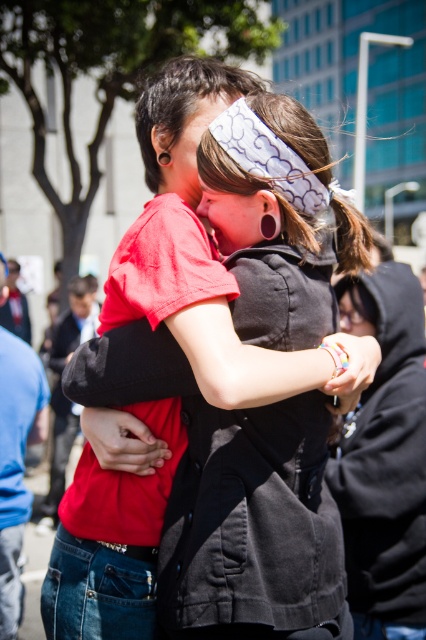
Question: Is white printed fabric headband at center smaller than matte white headband at center?

Choices:
 (A) no
 (B) yes

Answer: (A)

Question: Is white printed fabric headband at center positioned at the back of matte black face at center?

Choices:
 (A) no
 (B) yes

Answer: (A)

Question: Which object is positioned farthest from the matte white headband at center?

Choices:
 (A) white printed fabric headband at center
 (B) matte red shirt at center
 (C) red matte shirt at center

Answer: (C)

Question: Which object is the closest to the matte white headband at center?

Choices:
 (A) matte black face at center
 (B) matte red shirt at center
 (C) red matte shirt at center
 (D) white printed fabric headband at center

Answer: (B)

Question: Which is farther from the matte black face at center?

Choices:
 (A) matte red shirt at center
 (B) white printed fabric headband at center
 (C) red matte shirt at center

Answer: (B)

Question: In this image, where is white printed fabric headband at center located relative to matte white headband at center?

Choices:
 (A) right
 (B) left

Answer: (A)